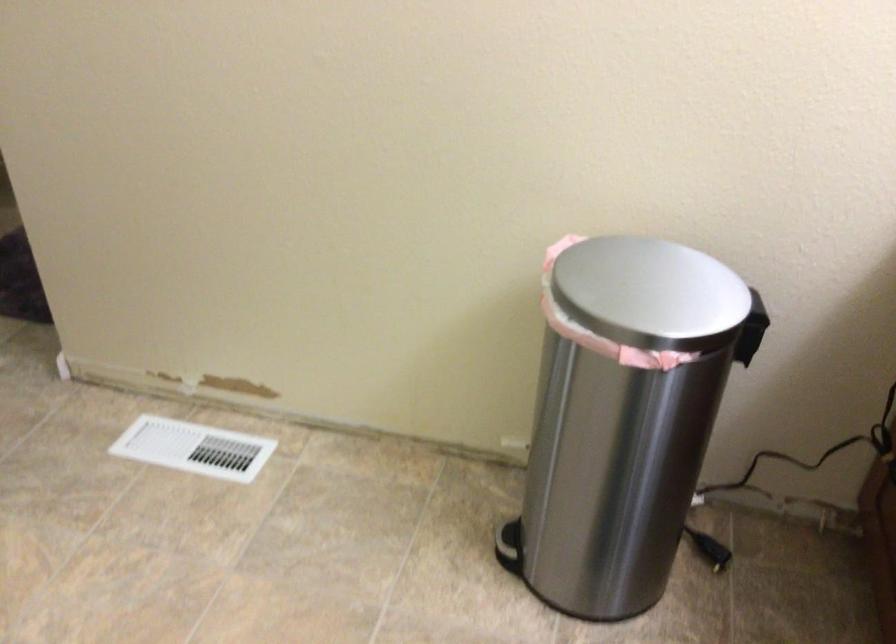
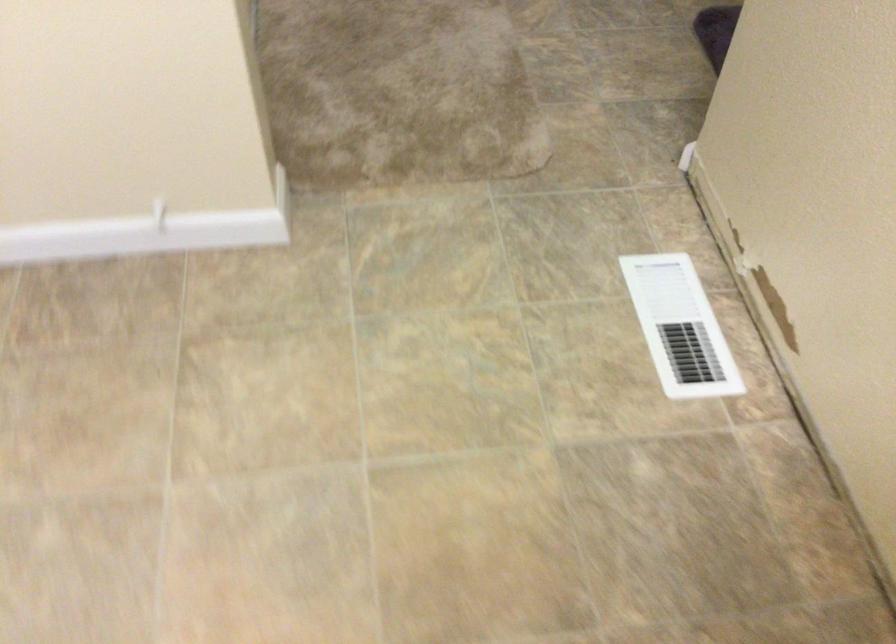
Based on the continuous images, in which direction is the camera rotating?

The rotation direction of the camera is left-down.